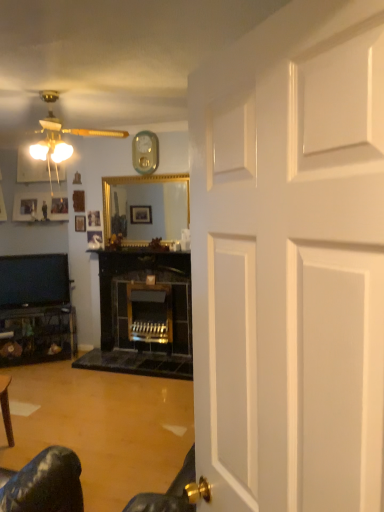
Question: Is wooden picture frame at upper left, acting as the 2th picture frame starting from the back, wider or thinner than wooden picture frame at center, arranged as the fourth picture frame when viewed from the back?

Choices:
 (A) wide
 (B) thin

Answer: (B)

Question: Choose the correct answer: Is wooden picture frame at upper left, arranged as the 3th picture frame when viewed from the left, inside wooden picture frame at center, arranged as the fourth picture frame when viewed from the back, or outside it?

Choices:
 (A) inside
 (B) outside

Answer: (B)

Question: Which of these objects is positioned farthest from the matte white ceiling fan at upper left?

Choices:
 (A) wooden picture frame at upper left, positioned as the second picture frame in left-to-right order
 (B) wooden picture frame at center, arranged as the fourth picture frame when viewed from the back
 (C) wooden picture frame at upper left, the 3th picture frame viewed from the front
 (D) gold-framed mirror at center
 (E) metallic silver clock at upper center

Answer: (B)

Question: Considering the real-world distances, which object is farthest from the matte black tv at left?

Choices:
 (A) matte white ceiling fan at upper left
 (B) wooden picture frame at center, the first picture frame when ordered from front to back
 (C) gold-framed mirror at center
 (D) matte black picture frame at upper left, which is the fourth picture frame in right-to-left order
 (E) wooden picture frame at upper left, acting as the 2th picture frame starting from the back

Answer: (A)